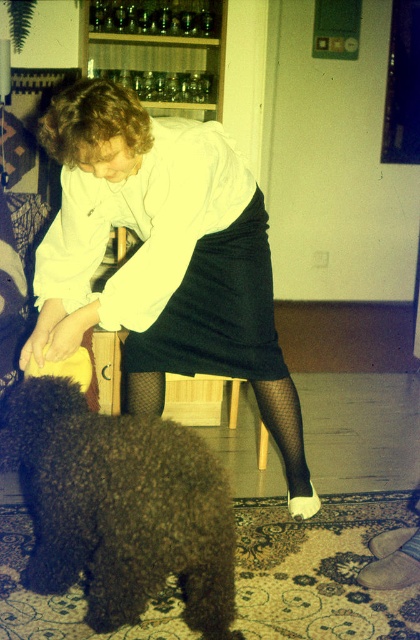
You are a photographer trying to capture the interaction between the person and the dog. You need to ensure that both the dark brown fur at lower left and the gray fabric stocking at lower right are clearly visible in the frame. Based on their positions, which object is closer to the camera?

The dark brown fur at lower left is located above the gray fabric stocking at lower right, so it is closer to the camera.

You are a delivery person who needs to place a small package on the floor in the lower left area of the room. According to the image, is there space to place the package at point [120,508] without disturbing the dark brown fur at lower left?

The point [120,508] is where the dark brown fur at lower left is located, so placing the package there would disturb it.